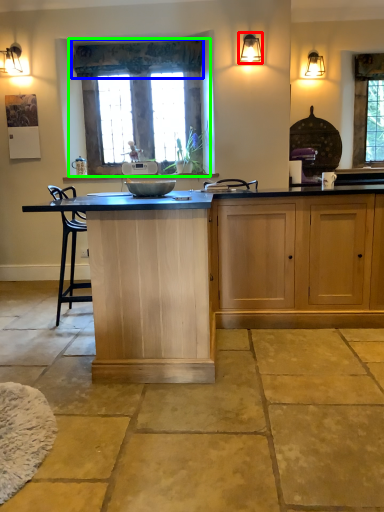
Question: Which object is the closest to the light fixture (highlighted by a red box)? Choose among these: curtain (highlighted by a blue box) or window (highlighted by a green box).

Choices:
 (A) curtain
 (B) window

Answer: (A)